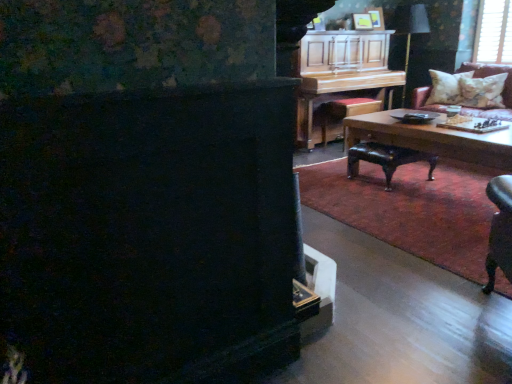
Question: From the image's perspective, is black fabric lampshade at upper right positioned above or below matte yellow picture frame at upper center?

Choices:
 (A) below
 (B) above

Answer: (A)

Question: Is black fabric lampshade at upper right wider or thinner than matte yellow picture frame at upper center?

Choices:
 (A) wide
 (B) thin

Answer: (A)

Question: Based on their relative distances, which object is nearer to the wooden stool at center, placed as the 1th stool when sorted from back to front?

Choices:
 (A) wooden piano at upper right
 (B) fluffy beige pillow at upper right, positioned as the 1th pillow in back-to-front order
 (C) matte yellow picture frame at upper center
 (D) leather stool at center, which is the 1th stool from front to back
 (E) leather couch with floral pillows at upper right

Answer: (A)

Question: Which object is positioned farthest from the wooden piano at upper right?

Choices:
 (A) black fabric lampshade at upper right
 (B) leather couch with floral pillows at upper right
 (C) white textured pillow at upper right, arranged as the second pillow when viewed from the back
 (D) matte yellow picture frame at upper center
 (E) white mesh screen at upper right

Answer: (B)